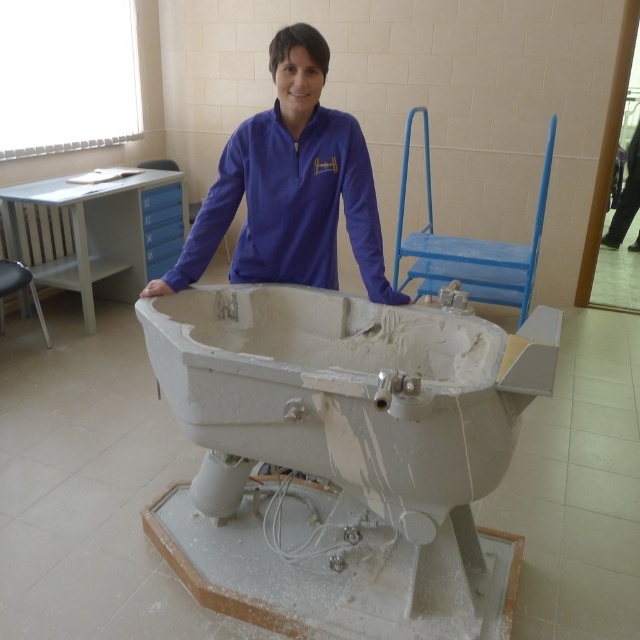
Is white matte bathtub at center smaller than purple fleece at center?

No.

Is white matte bathtub at center thinner than purple fleece at center?

In fact, white matte bathtub at center might be wider than purple fleece at center.

Does point (465, 458) lie in front of point (301, 284)?

Yes, point (465, 458) is in front of point (301, 284).

Locate an element on the screen. white matte bathtub at center is located at coordinates (348, 392).